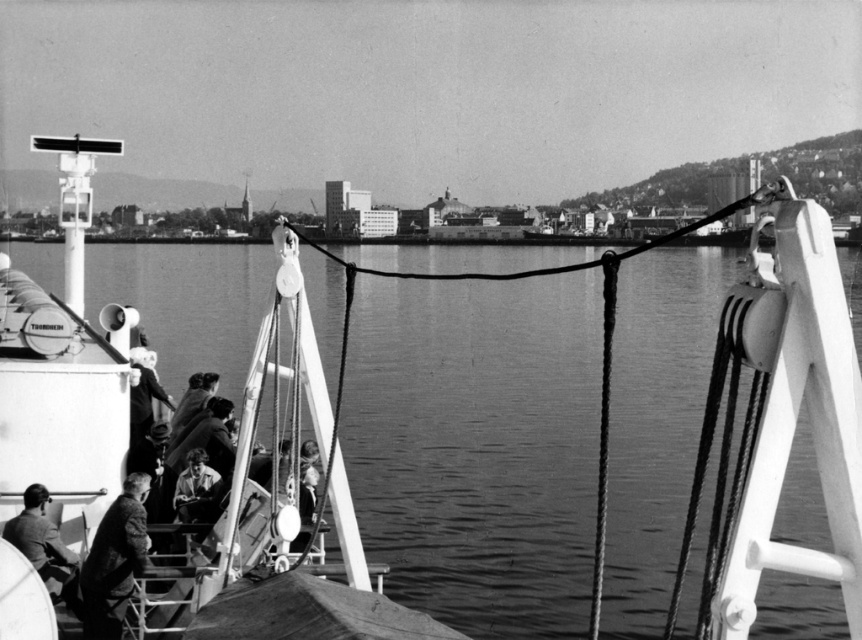
Question: Can you confirm if smooth water at center is positioned below smooth leather jacket at lower center?

Choices:
 (A) yes
 (B) no

Answer: (B)

Question: Which of these objects is positioned farthest from the dark suit at lower left?

Choices:
 (A) smooth leather jacket at lower center
 (B) smooth water at center

Answer: (B)

Question: Which point is closer to the camera?

Choices:
 (A) smooth water at center
 (B) smooth leather jacket at lower center

Answer: (A)

Question: Does smooth water at center appear under dark suit at lower left?

Choices:
 (A) no
 (B) yes

Answer: (A)

Question: Is smooth water at center thinner than dark suit at lower left?

Choices:
 (A) yes
 (B) no

Answer: (B)

Question: Which object is the farthest from the smooth water at center?

Choices:
 (A) smooth leather jacket at lower center
 (B) dark suit at lower left

Answer: (B)